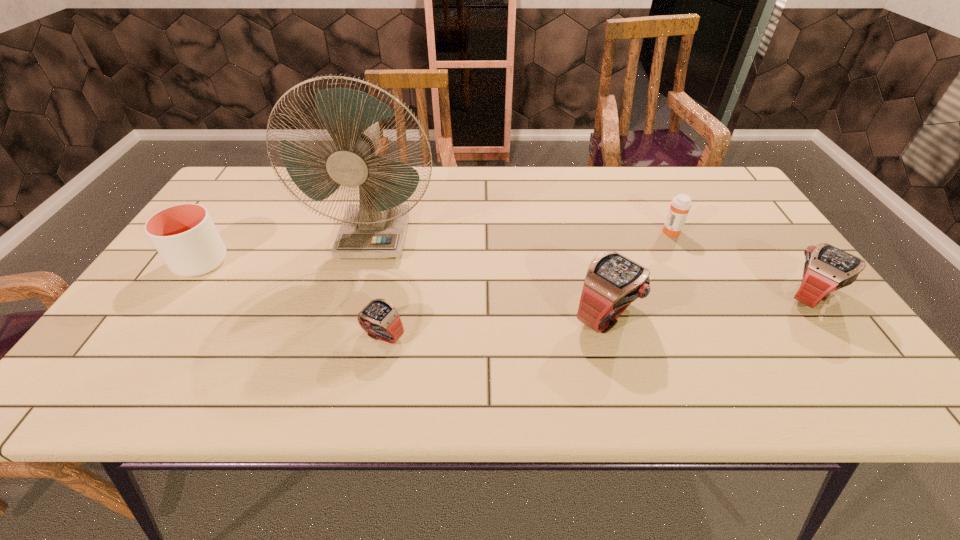
Locate an element on the screen. This screenshot has width=960, height=540. object that can be found as the fourth closest to the leftmost object is located at coordinates (681, 204).

The image size is (960, 540). Find the location of `object that is the fifth closest to the medicine`. object that is the fifth closest to the medicine is located at coordinates (184, 235).

The image size is (960, 540). I want to click on watch object that ranks as the closest to the fan, so click(379, 318).

Select which watch is the closest to the second tallest watch. Please provide its 2D coordinates. Your answer should be formatted as a tuple, i.e. [(x, y)], where the tuple contains the x and y coordinates of a point satisfying the conditions above.

[(612, 282)]

Where is `vacant space that satisfies the following two spatial constraints: 1. on the front-facing side of the tallest object; 2. on the left side of the fourth object from left to right`? The height and width of the screenshot is (540, 960). vacant space that satisfies the following two spatial constraints: 1. on the front-facing side of the tallest object; 2. on the left side of the fourth object from left to right is located at coordinates (353, 315).

I want to click on free space that satisfies the following two spatial constraints: 1. on the front-facing side of the fan; 2. on the left side of the second watch from left to right, so click(x=353, y=315).

Where is `blank space that satisfies the following two spatial constraints: 1. on the back side of the rightmost watch; 2. on the left side of the shortest object`? This screenshot has height=540, width=960. blank space that satisfies the following two spatial constraints: 1. on the back side of the rightmost watch; 2. on the left side of the shortest object is located at coordinates (391, 296).